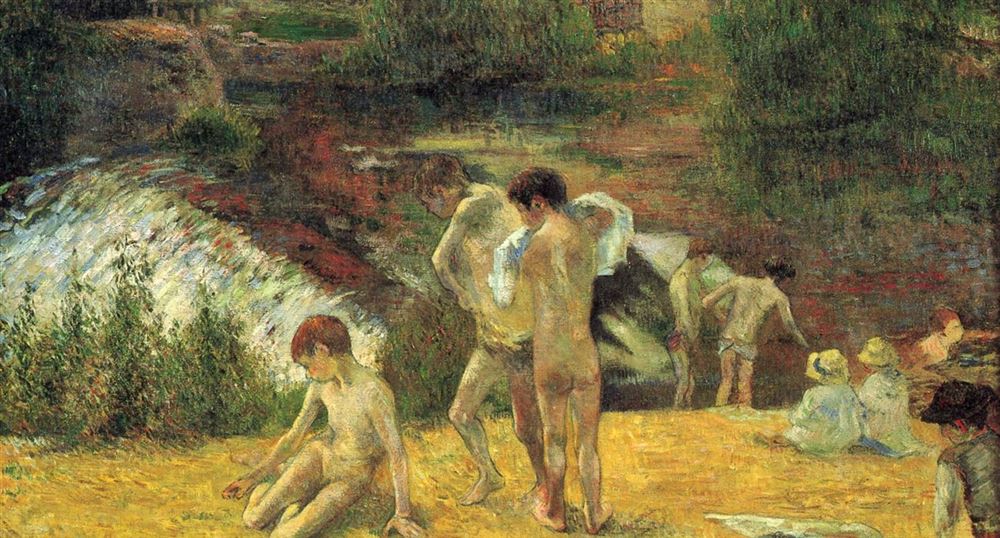
At what (x,y) coordinates should I click in order to perform the action: click on newspaper. Please return your answer as a coordinate pair (x, y). The image size is (1000, 538). Looking at the image, I should click on (810, 526).